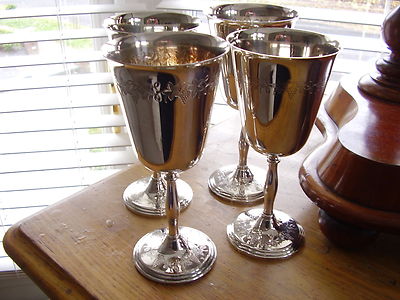
Where is `glass, clear window`? The width and height of the screenshot is (400, 300). glass, clear window is located at coordinates (29, 26), (359, 32), (111, 119), (355, 51).